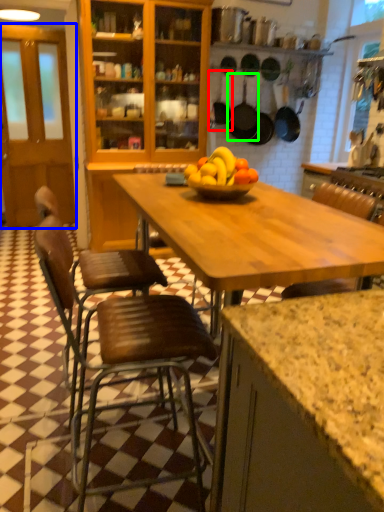
Question: Which object is positioned farthest from frying pan (highlighted by a red box)? Select from glass door (highlighted by a blue box) and frying pan (highlighted by a green box).

Choices:
 (A) glass door
 (B) frying pan

Answer: (A)